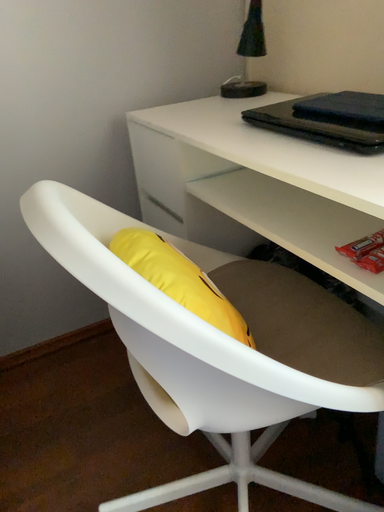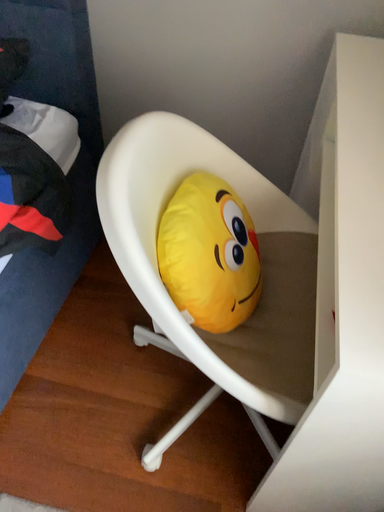
Question: Which way did the camera rotate in the video?

Choices:
 (A) rotated upward
 (B) rotated downward

Answer: (B)